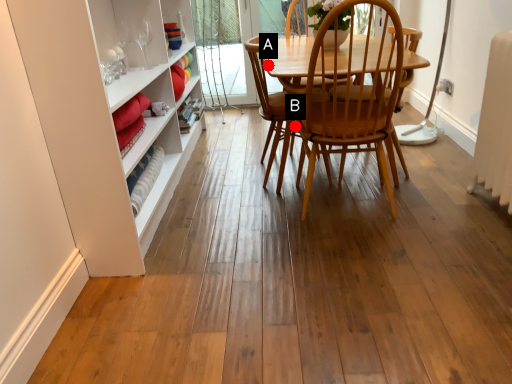
Question: Two points are circled on the image, labeled by A and B beside each circle. Which point is closer to the camera taking this photo?

Choices:
 (A) A is closer
 (B) B is closer

Answer: (A)